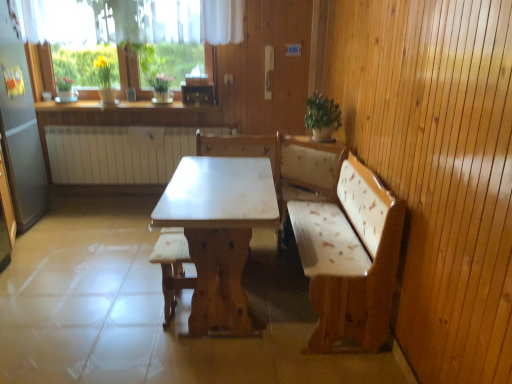
Question: In terms of width, does white fabric cushion at center look wider or thinner when compared to green leafy plant at upper center?

Choices:
 (A) thin
 (B) wide

Answer: (A)

Question: From the image's perspective, relative to green leafy plant at upper center, is white fabric cushion at center above or below?

Choices:
 (A) below
 (B) above

Answer: (A)

Question: Considering the real-world distances, which object is closest to the white glossy counter top at upper center?

Choices:
 (A) light brown wood table at center
 (B) white marble table at center
 (C) green glossy vase at upper center, which is the 1th plant from right to left
 (D) white fabric cushion at center
 (E) green leafy plant at upper center

Answer: (C)

Question: Estimate the real-world distances between objects in this image. Which object is closer to the green matte plant at upper left, arranged as the 2th plant when viewed from the right?

Choices:
 (A) white marble table at center
 (B) green leafy plant at upper center
 (C) white glossy counter top at upper center
 (D) green glossy vase at upper center, which is the 1th plant from right to left
 (E) white fabric cushion at center

Answer: (D)